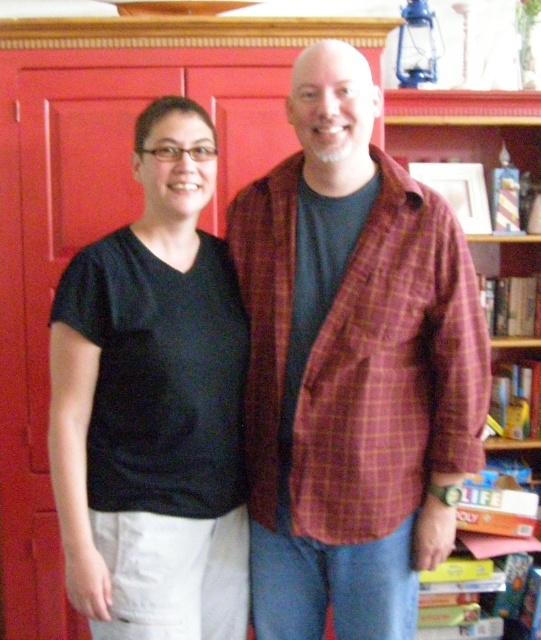
You are trying to decide where to place a new painting. You have two options for placement locations in the scene. The first location is where the plaid fabric shirt at center is currently standing. The second location is where the wooden bookshelf at right is placed. Which location would allow the painting to be placed higher up on the wall?

→ The wooden bookshelf at right is placed higher up than the plaid fabric shirt at center, so placing the painting where the wooden bookshelf at right is located would allow it to be placed higher on the wall.